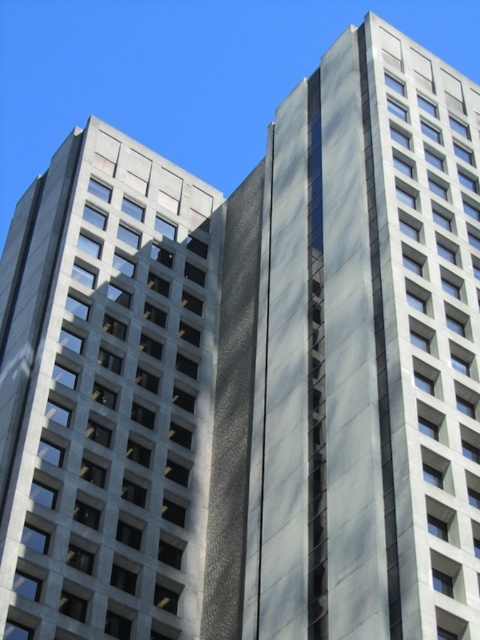
Question: Which point is closer to the camera?

Choices:
 (A) gray concrete building at left
 (B) gray concrete building at center

Answer: (B)

Question: Which point appears farthest from the camera in this image?

Choices:
 (A) (70, 152)
 (B) (452, 179)

Answer: (A)

Question: Is the position of gray concrete building at center less distant than that of gray concrete building at left?

Choices:
 (A) yes
 (B) no

Answer: (A)

Question: Is gray concrete building at center to the left of gray concrete building at left from the viewer's perspective?

Choices:
 (A) yes
 (B) no

Answer: (B)

Question: Does gray concrete building at center have a smaller size compared to gray concrete building at left?

Choices:
 (A) yes
 (B) no

Answer: (B)